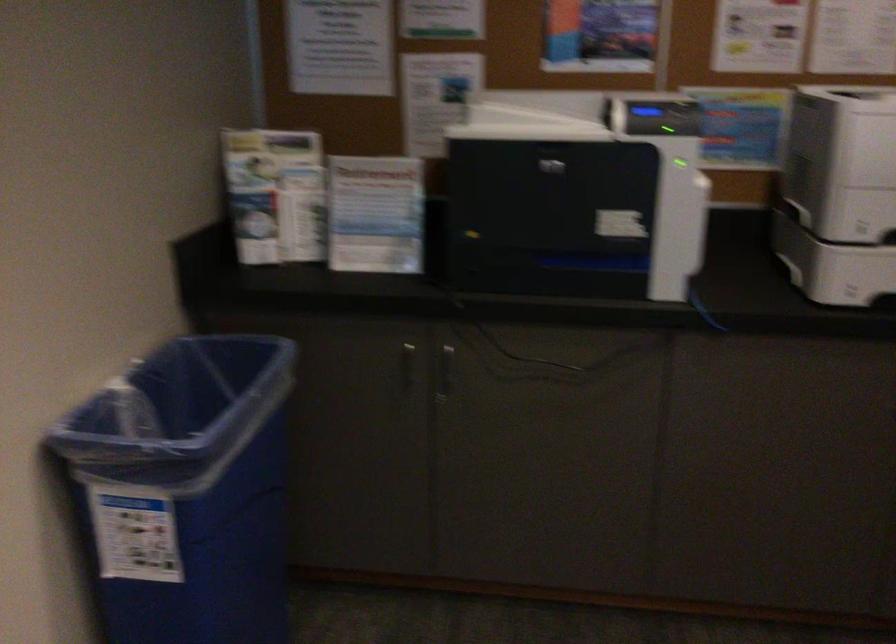
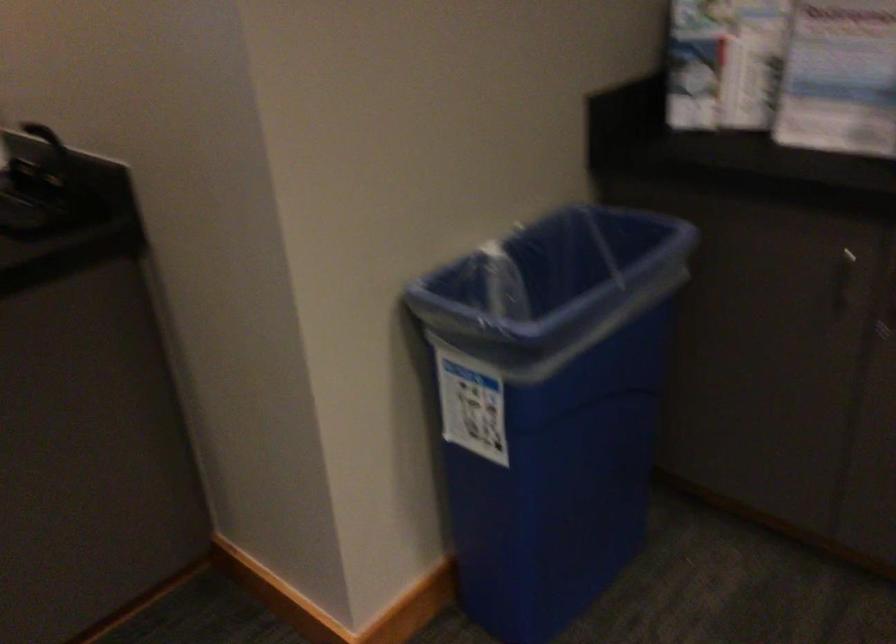
Question: I am providing you with two images of the same scene from different viewpoints. Please identify which objects are invisible in image2.

Choices:
 (A) blue trash can rim
 (B) silver cabinet handle
 (C) paper pamphlet
 (D) none of these

Answer: (D)